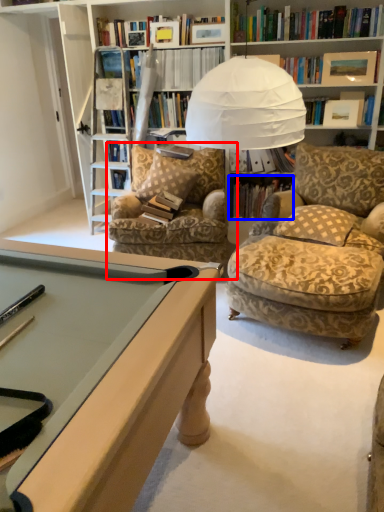
Question: Among these objects, which one is nearest to the camera, chair (highlighted by a red box) or book (highlighted by a blue box)?

Choices:
 (A) chair
 (B) book

Answer: (A)